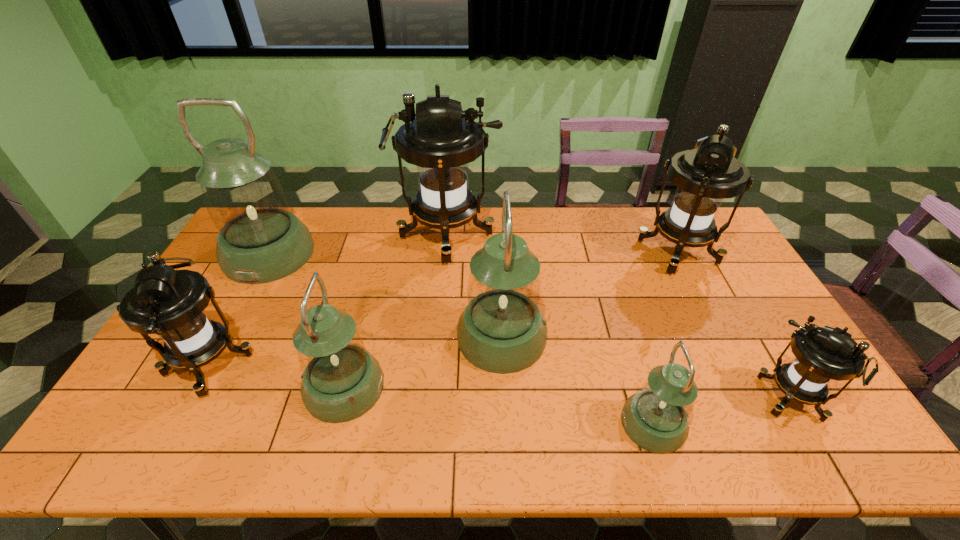
I want to click on vacant space located 0.340m on the front of the biggest greenish lantern, so pos(204,374).

You are a GUI agent. You are given a task and a screenshot of the screen. Output one action in this format:
    pyautogui.click(x=<x>, y=<y>)
    Task: Click on the free spot located 0.130m on the right of the biggest black lantern
    This screenshot has height=540, width=960.
    Given the screenshot: What is the action you would take?
    pyautogui.click(x=535, y=237)

I want to click on free region located 0.310m on the front of the second biggest black lantern, so click(x=731, y=359).

Find the location of a particular element. The image size is (960, 540). free space located 0.320m on the back of the second biggest greenish lantern is located at coordinates (497, 240).

Find the location of a particular element. Image resolution: width=960 pixels, height=540 pixels. vacant space located 0.300m on the right of the leftmost black lantern is located at coordinates (363, 364).

Find the location of a particular element. This screenshot has width=960, height=540. vacant space located 0.230m on the back of the third biggest greenish lantern is located at coordinates (368, 296).

You are a GUI agent. You are given a task and a screenshot of the screen. Output one action in this format:
    pyautogui.click(x=<x>, y=<y>)
    Task: Click on the free space located on the back of the smallest black lantern
    This screenshot has height=540, width=960.
    Given the screenshot: What is the action you would take?
    pyautogui.click(x=730, y=293)

The height and width of the screenshot is (540, 960). Find the location of `free space located 0.360m on the back of the third object from right to left`. free space located 0.360m on the back of the third object from right to left is located at coordinates (613, 295).

I want to click on object that is at the far left corner, so click(259, 241).

Locate an element on the screen. The width and height of the screenshot is (960, 540). object located in the far right corner section of the desktop is located at coordinates (705, 176).